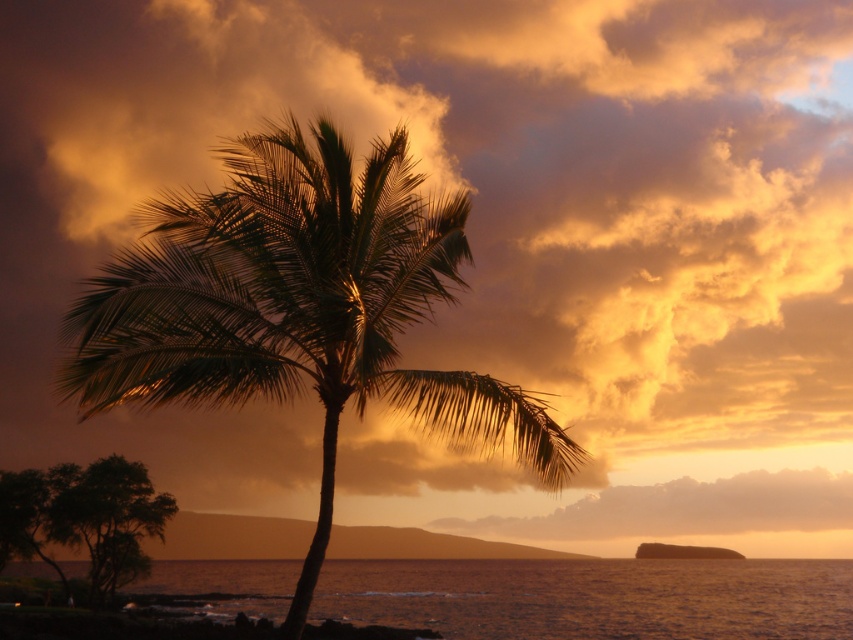
Question: Can you confirm if green leafy palm tree at center is positioned to the left of smooth water at lower center?

Choices:
 (A) no
 (B) yes

Answer: (B)

Question: Can you confirm if green leafy palm tree at center is positioned to the right of smooth water at lower center?

Choices:
 (A) yes
 (B) no

Answer: (B)

Question: Which point is farther to the camera?

Choices:
 (A) (267, 305)
 (B) (579, 621)

Answer: (B)

Question: Which of the following is the farthest from the observer?

Choices:
 (A) (521, 577)
 (B) (277, 189)

Answer: (A)

Question: Which point is farther from the camera taking this photo?

Choices:
 (A) (231, 381)
 (B) (665, 627)

Answer: (B)

Question: Can you confirm if green leafy palm tree at center is thinner than smooth water at lower center?

Choices:
 (A) no
 (B) yes

Answer: (B)